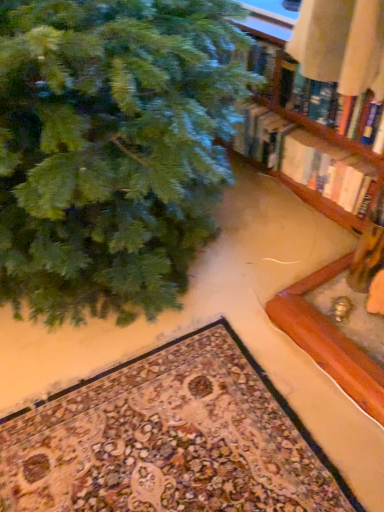
Question: Should I look upward or downward to see hardcover book at upper right?

Choices:
 (A) up
 (B) down

Answer: (A)

Question: Is wooden bookshelf at upper right touching green matte christmas tree at upper left?

Choices:
 (A) no
 (B) yes

Answer: (A)

Question: Can you confirm if wooden bookshelf at upper right is smaller than green matte christmas tree at upper left?

Choices:
 (A) no
 (B) yes

Answer: (B)

Question: Can you confirm if wooden bookshelf at upper right is shorter than green matte christmas tree at upper left?

Choices:
 (A) yes
 (B) no

Answer: (A)

Question: Considering the relative sizes of wooden bookshelf at upper right and green matte christmas tree at upper left in the image provided, is wooden bookshelf at upper right bigger than green matte christmas tree at upper left?

Choices:
 (A) yes
 (B) no

Answer: (B)

Question: From a real-world perspective, does wooden bookshelf at upper right stand above green matte christmas tree at upper left?

Choices:
 (A) yes
 (B) no

Answer: (B)

Question: Does wooden bookshelf at upper right come in front of green matte christmas tree at upper left?

Choices:
 (A) no
 (B) yes

Answer: (A)

Question: Is wooden bookshelf at upper right behind carpeted mat at lower center?

Choices:
 (A) yes
 (B) no

Answer: (A)

Question: Is the depth of wooden bookshelf at upper right less than that of carpeted mat at lower center?

Choices:
 (A) no
 (B) yes

Answer: (A)

Question: Would you say wooden bookshelf at upper right is outside carpeted mat at lower center?

Choices:
 (A) yes
 (B) no

Answer: (A)

Question: Is wooden bookshelf at upper right bigger than carpeted mat at lower center?

Choices:
 (A) yes
 (B) no

Answer: (B)

Question: From a real-world perspective, is wooden bookshelf at upper right positioned over carpeted mat at lower center based on gravity?

Choices:
 (A) no
 (B) yes

Answer: (B)

Question: From the image's perspective, is wooden bookshelf at upper right located above carpeted mat at lower center?

Choices:
 (A) no
 (B) yes

Answer: (B)

Question: Can you confirm if wooden bookshelf at upper right is smaller than hardcover book at upper right?

Choices:
 (A) no
 (B) yes

Answer: (A)